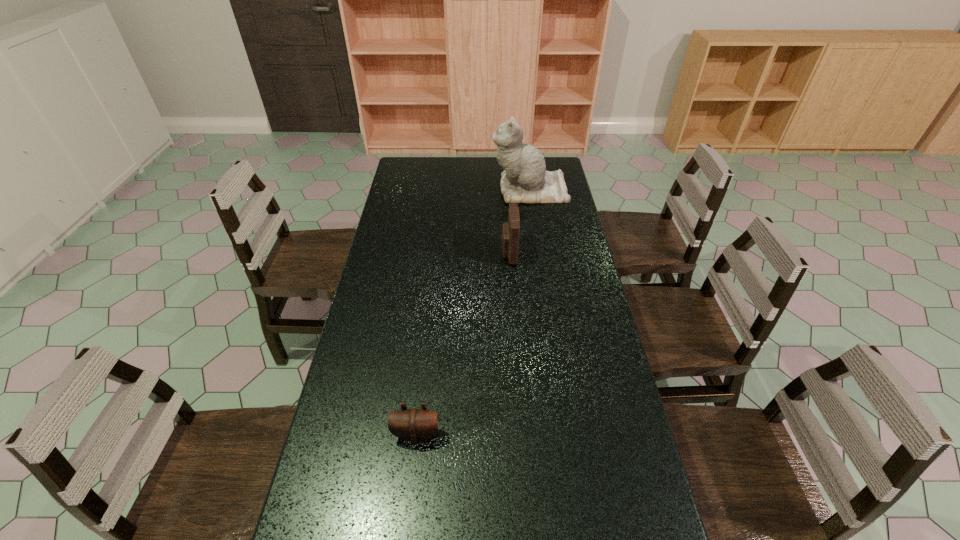
Image resolution: width=960 pixels, height=540 pixels. Identify the location of vacant space located 0.360m with an open flap on the taller pouch. (404, 253).

The height and width of the screenshot is (540, 960). Find the location of `vacant space located with an open flap on the taller pouch`. vacant space located with an open flap on the taller pouch is located at coordinates (437, 253).

Find the location of a particular element. vacant space located 0.090m with the flap open on the nearer pouch is located at coordinates (411, 483).

At what (x,y) coordinates should I click in order to perform the action: click on object located in the far edge section of the desktop. Please return your answer as a coordinate pair (x, y). Image resolution: width=960 pixels, height=540 pixels. Looking at the image, I should click on (525, 180).

I want to click on object located in the right edge section of the desktop, so click(x=525, y=180).

Image resolution: width=960 pixels, height=540 pixels. What are the coordinates of `object present at the far right corner` in the screenshot? It's located at (525, 180).

Find the location of a particular element. This screenshot has width=960, height=540. free point at the far edge is located at coordinates (481, 179).

Locate an element on the screen. The width and height of the screenshot is (960, 540). vacant area at the left edge of the desktop is located at coordinates (411, 265).

Locate an element on the screen. The image size is (960, 540). blank area at the right edge is located at coordinates (593, 506).

The image size is (960, 540). In the image, there is a desktop. What are the coordinates of `vacant space at the far left corner` in the screenshot? It's located at (412, 178).